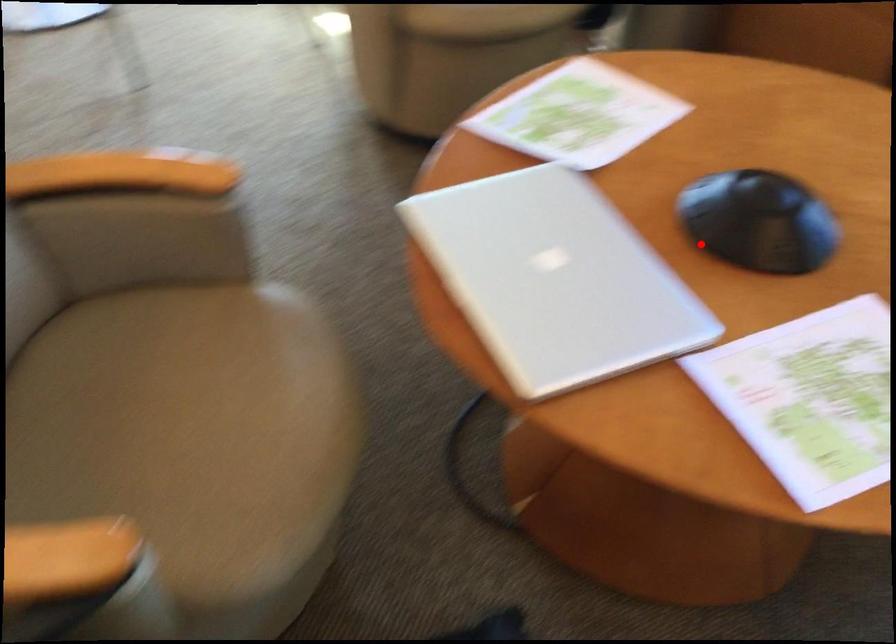
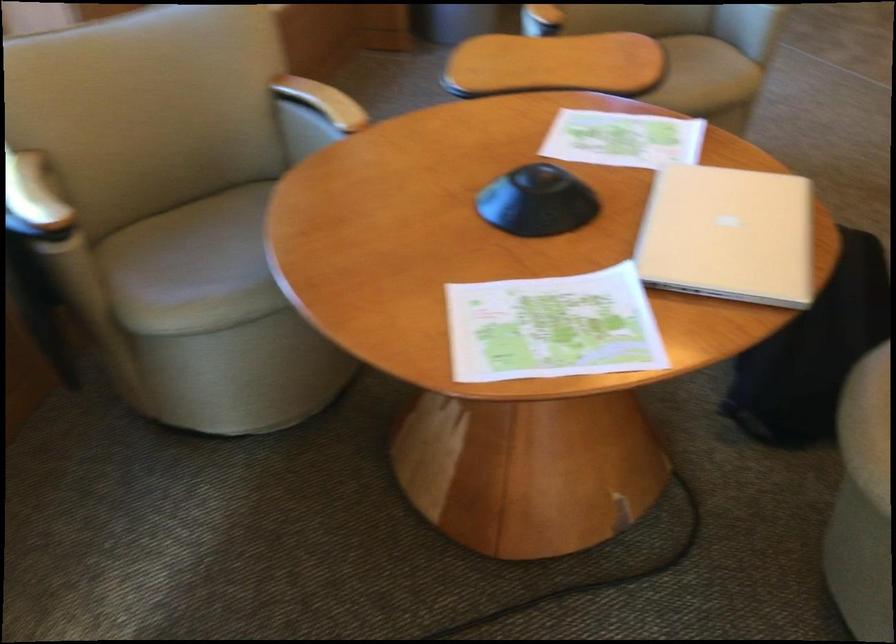
Question: I am providing you with two images of the same scene from different viewpoints. In image1, a red point is highlighted. Considering the same 3D point in image2, which of the following is correct?

Choices:
 (A) It is closer
 (B) It is farther

Answer: (B)